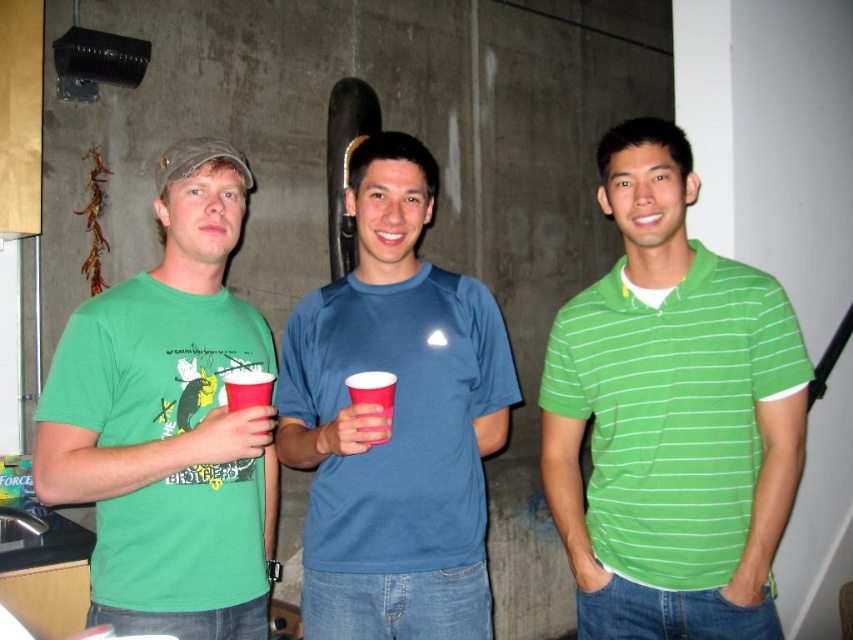
You are a photographer setting up a shot of the three people in the image. You need to place a light source between the point at (671,609) and the point at (386,394). Which point should the light be closer to in order to ensure it illuminates the area between them effectively?

The light source should be placed closer to point (386,394) because point (671,609) is further away from the camera, so positioning the light closer to the nearer point will better illuminate the space between them.